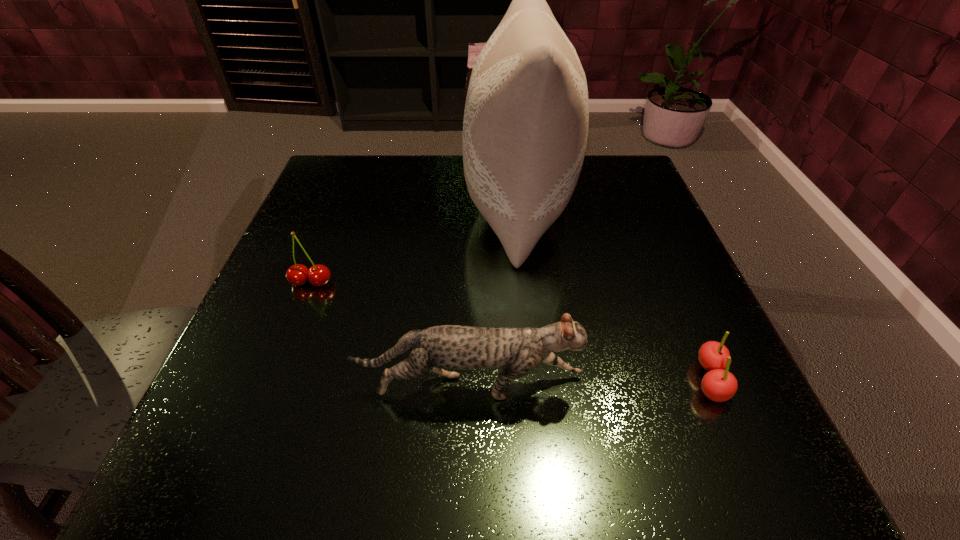
The height and width of the screenshot is (540, 960). What are the coordinates of `the tallest object` in the screenshot? It's located at (525, 128).

Identify the location of the second tallest object. (517, 352).

Identify the location of the taller cherry. (319, 275).

This screenshot has height=540, width=960. Identify the location of the left cherry. (319, 275).

The width and height of the screenshot is (960, 540). What are the coordinates of `the shortest object` in the screenshot? It's located at (718, 384).

The height and width of the screenshot is (540, 960). I want to click on the rightmost object, so click(718, 384).

You are a GUI agent. You are given a task and a screenshot of the screen. Output one action in this format:
    pyautogui.click(x=<x>, y=<y>)
    Task: Click on the free point located on the front side of the cushion
    Image resolution: width=960 pixels, height=540 pixels.
    Given the screenshot: What is the action you would take?
    pyautogui.click(x=429, y=206)

Locate an element on the screen. This screenshot has width=960, height=540. vacant space located on the front side of the cushion is located at coordinates (335, 206).

Where is `vacant region located 0.120m on the front side of the cushion`? vacant region located 0.120m on the front side of the cushion is located at coordinates (411, 206).

Locate an element on the screen. The image size is (960, 540). vacant space situated 0.240m on the face of the cat is located at coordinates (746, 387).